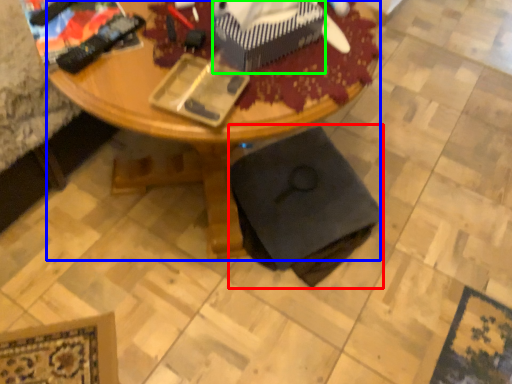
Question: Estimate the real-world distances between objects in this image. Which object is closer to swivel chair (highlighted by a red box), desk (highlighted by a blue box) or box (highlighted by a green box)?

Choices:
 (A) desk
 (B) box

Answer: (A)